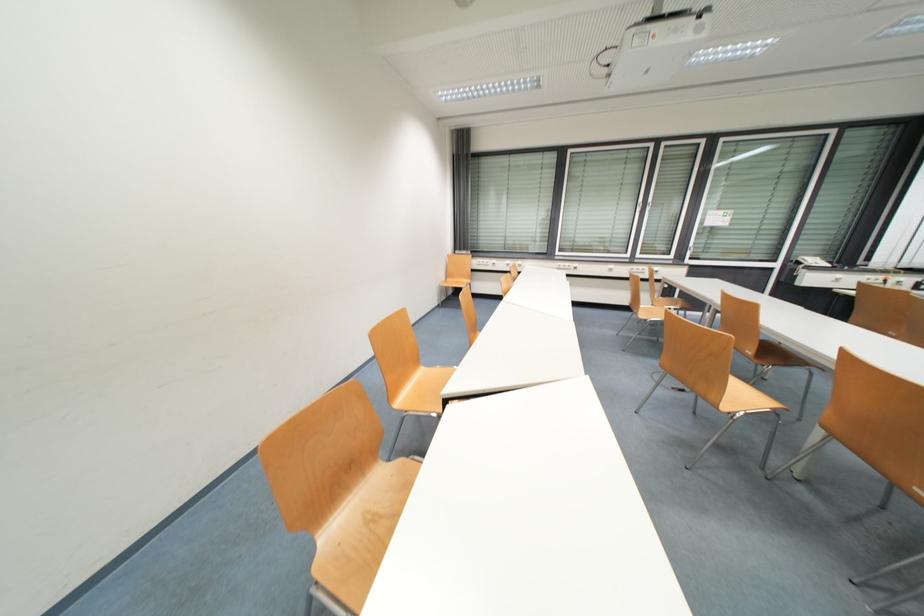
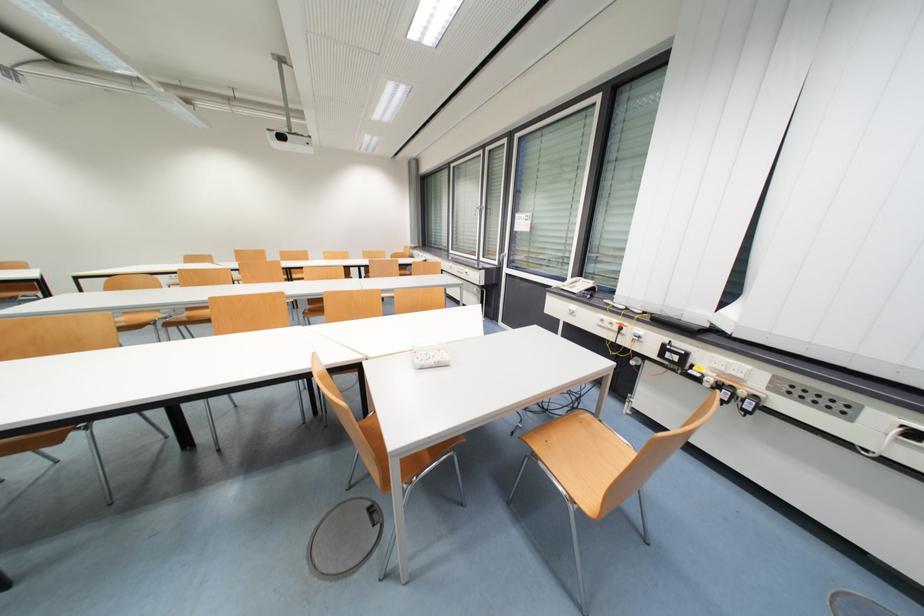
In the second image, find the point that corresponds to (x=845, y=277) in the first image.

(578, 309)